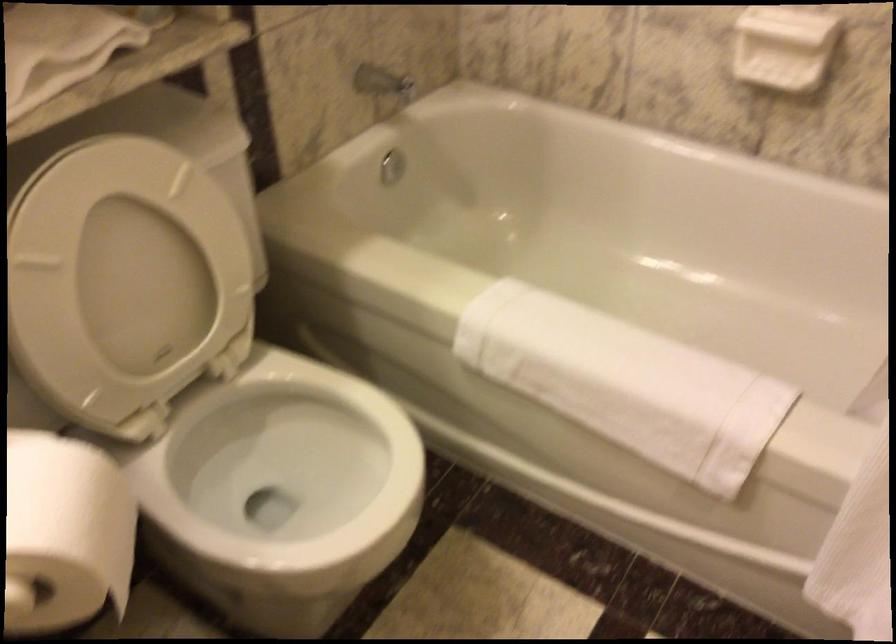
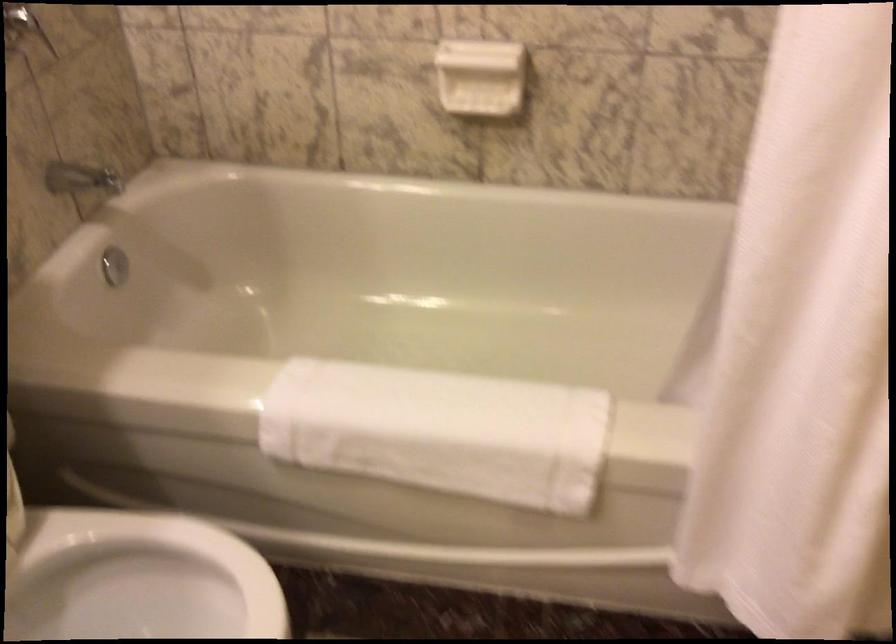
In the second image, find the point that corresponds to (x=614, y=379) in the first image.

(440, 431)